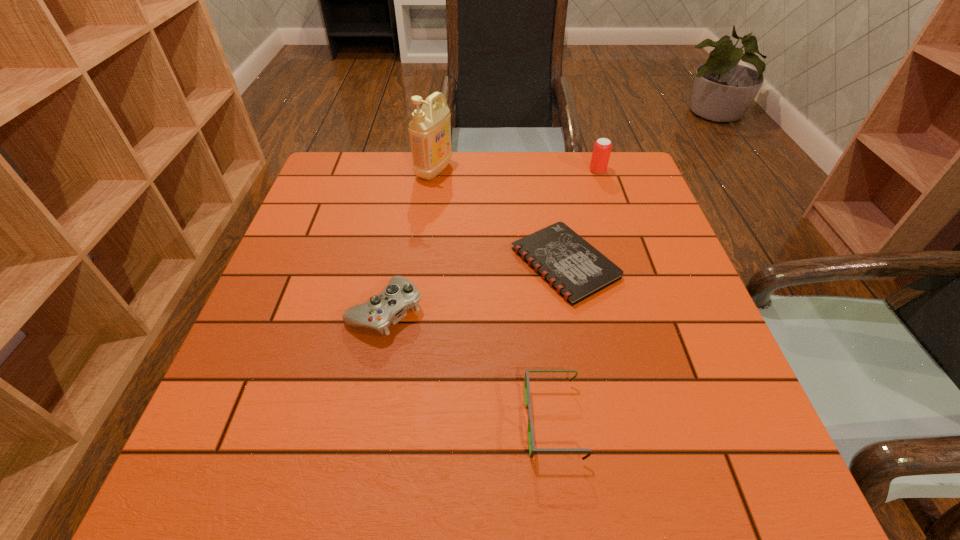
Locate an element on the screen. blank region between the shortest object and the fourth shortest object is located at coordinates (581, 217).

Locate an element on the screen. This screenshot has width=960, height=540. free point between the shortest object and the second shortest object is located at coordinates (559, 342).

Locate an element on the screen. Image resolution: width=960 pixels, height=540 pixels. object that is the second closest to the tallest object is located at coordinates click(390, 306).

Identify which object is the fourth nearest to the control. Please provide its 2D coordinates. Your answer should be formatted as a tuple, i.e. [(x, y)], where the tuple contains the x and y coordinates of a point satisfying the conditions above.

[(602, 148)]

You are a GUI agent. You are given a task and a screenshot of the screen. Output one action in this format:
    pyautogui.click(x=<x>, y=<y>)
    Task: Click on the free space that satisfies the following two spatial constraints: 1. on the back side of the beer can; 2. on the left side of the shortest object
    
    Given the screenshot: What is the action you would take?
    pyautogui.click(x=547, y=171)

At what (x,y) coordinates should I click in order to perform the action: click on blank space that satisfies the following two spatial constraints: 1. on the back side of the third shortest object; 2. on the right side of the shortest object. Please return your answer as a coordinate pair (x, y). This screenshot has height=540, width=960. Looking at the image, I should click on (395, 264).

Locate an element on the screen. vacant area in the image that satisfies the following two spatial constraints: 1. on the back side of the tallest object; 2. on the left side of the third shortest object is located at coordinates (412, 170).